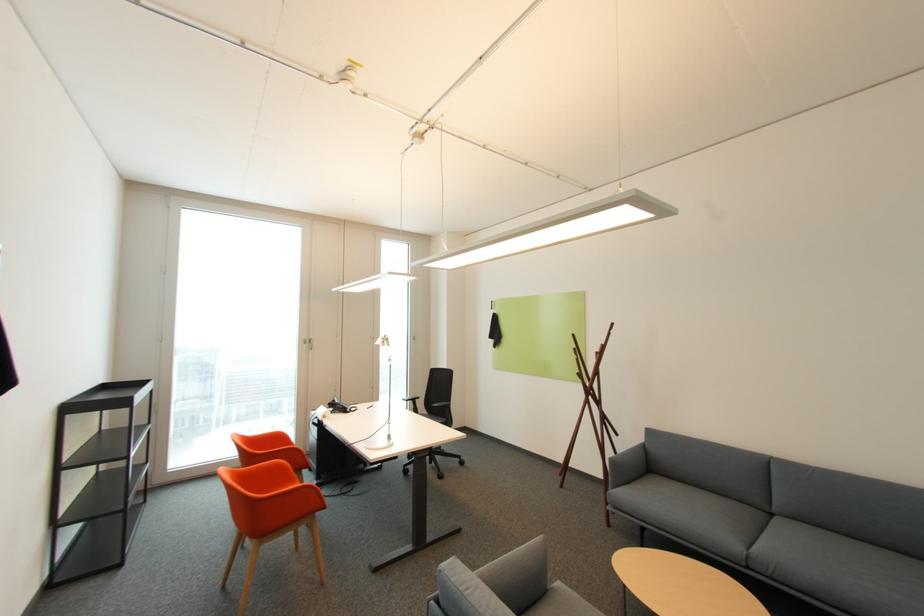
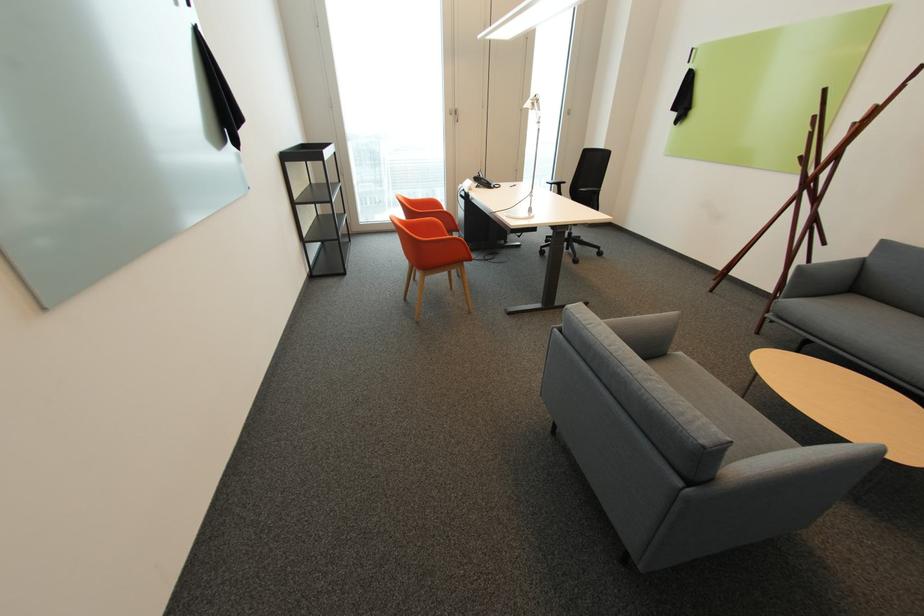
Where in the second image is the point corresponding to point 383,344 from the first image?

(531, 107)